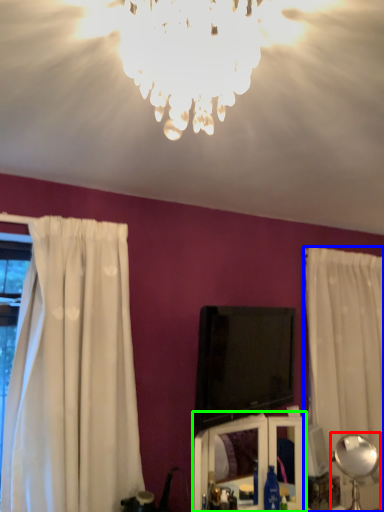
Question: Estimate the real-world distances between objects in this image. Which object is closer to lamp (highlighted by a red box), curtain (highlighted by a blue box) or vanity (highlighted by a green box)?

Choices:
 (A) curtain
 (B) vanity

Answer: (B)